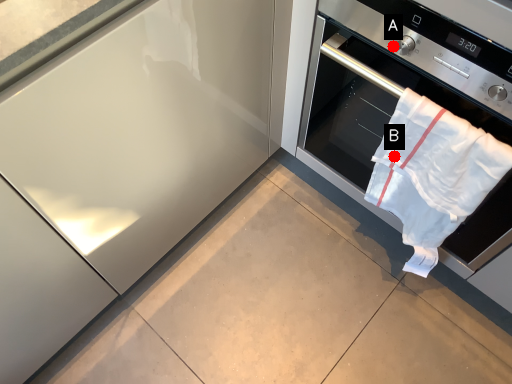
Question: Two points are circled on the image, labeled by A and B beside each circle. Which of the following is the farthest from the observer?

Choices:
 (A) A is further
 (B) B is further

Answer: (B)